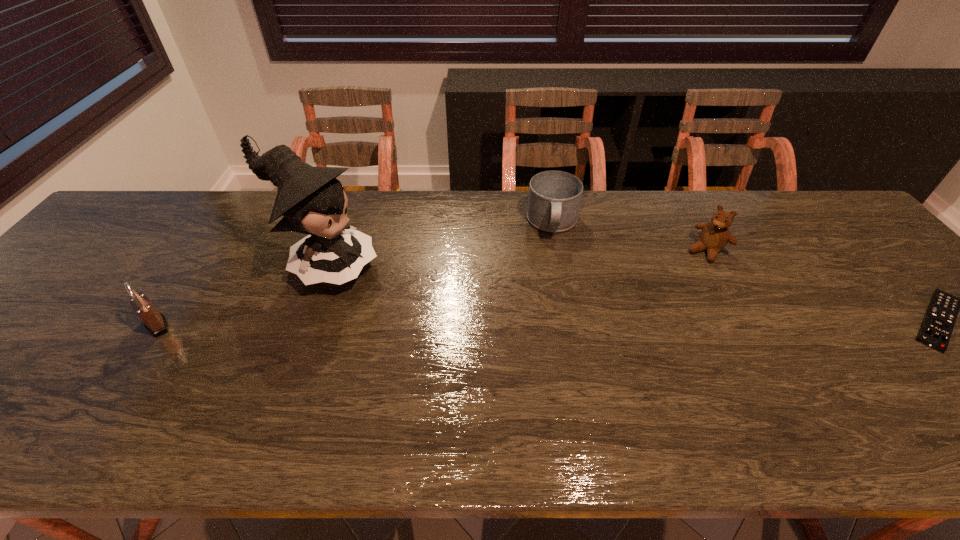
Where is `vacant spot on the desktop that is between the leftmost object and the shortest object and is positioned on the side of the mug with the handle`? This screenshot has width=960, height=540. vacant spot on the desktop that is between the leftmost object and the shortest object and is positioned on the side of the mug with the handle is located at coordinates (554, 323).

Locate an element on the screen. The image size is (960, 540). free spot on the desktop that is between the padlock and the rightmost object and is positioned at the face of the fourth object from right to left is located at coordinates (444, 323).

The image size is (960, 540). I want to click on free space on the desktop that is between the leftmost object and the rightmost object and is positioned at the face of the fourth object from left to right, so click(x=641, y=322).